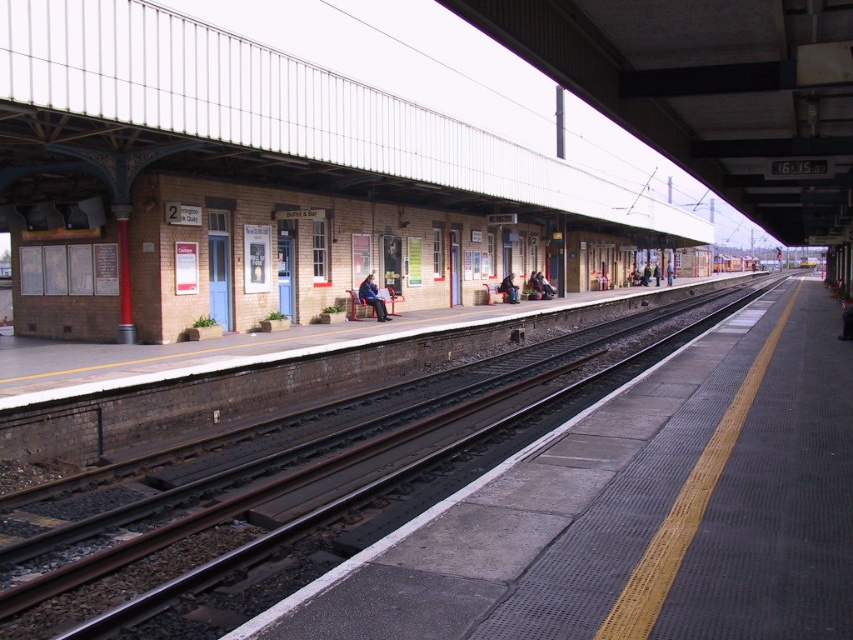
Is blue denim jacket at center closer to the viewer compared to metallic silver train at center?

Yes, blue denim jacket at center is in front of metallic silver train at center.

Which is more to the left, blue denim jacket at center or metallic silver train at center?

From the viewer's perspective, blue denim jacket at center appears more on the left side.

What do you see at coordinates (372, 298) in the screenshot?
I see `blue denim jacket at center` at bounding box center [372, 298].

The height and width of the screenshot is (640, 853). Find the location of `blue denim jacket at center`. blue denim jacket at center is located at coordinates (372, 298).

Is point (218, 564) in front of point (380, 305)?

Yes, point (218, 564) is in front of point (380, 305).

Is brown wooden track at center shorter than blue denim jacket at center?

In fact, brown wooden track at center may be taller than blue denim jacket at center.

Does point (192, 627) lie behind point (366, 292)?

No, it is not.

Image resolution: width=853 pixels, height=640 pixels. What are the coordinates of `brown wooden track at center` in the screenshot? It's located at (311, 493).

Which is above, brown wooden track at center or metallic silver train at center?

metallic silver train at center is above.

Describe the element at coordinates (311, 493) in the screenshot. I see `brown wooden track at center` at that location.

Where is `brown wooden track at center`? The image size is (853, 640). brown wooden track at center is located at coordinates (311, 493).